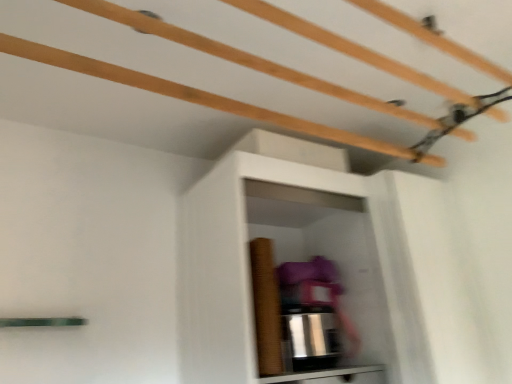
Where is `matte brown cabinet at lower center`? This screenshot has width=512, height=384. matte brown cabinet at lower center is located at coordinates (332, 376).

This screenshot has height=384, width=512. What do you see at coordinates (332, 376) in the screenshot? I see `matte brown cabinet at lower center` at bounding box center [332, 376].

Describe the element at coordinates (233, 62) in the screenshot. The image size is (512, 384). I see `white matte shelf at center` at that location.

At what (x,y) coordinates should I click in order to perform the action: click on white matte shelf at center. Please return your answer as a coordinate pair (x, y). The image size is (512, 384). Looking at the image, I should click on (233, 62).

I want to click on matte brown cabinet at lower center, so click(x=332, y=376).

Can you confirm if matte brown cabinet at lower center is positioned to the left of white matte shelf at center?

Incorrect, matte brown cabinet at lower center is not on the left side of white matte shelf at center.

Is matte brown cabinet at lower center behind white matte shelf at center?

That is True.

Does point (356, 375) appear closer or farther from the camera than point (364, 79)?

Point (356, 375).

From the image's perspective, is matte brown cabinet at lower center on top of white matte shelf at center?

Actually, matte brown cabinet at lower center appears below white matte shelf at center in the image.

From a real-world perspective, is matte brown cabinet at lower center physically below white matte shelf at center?

Yes, from a real-world perspective, matte brown cabinet at lower center is below white matte shelf at center.

Looking at their sizes, would you say matte brown cabinet at lower center is wider or thinner than white matte shelf at center?

matte brown cabinet at lower center is thinner than white matte shelf at center.

From the picture: Considering the relative sizes of matte brown cabinet at lower center and white matte shelf at center in the image provided, is matte brown cabinet at lower center shorter than white matte shelf at center?

No.

Can you confirm if matte brown cabinet at lower center is smaller than white matte shelf at center?

Yes, matte brown cabinet at lower center is smaller than white matte shelf at center.

Is matte brown cabinet at lower center spatially inside white matte shelf at center, or outside of it?

matte brown cabinet at lower center is outside white matte shelf at center.

Does matte brown cabinet at lower center touch white matte shelf at center?

matte brown cabinet at lower center and white matte shelf at center are clearly separated.

Is white matte shelf at center at the back of matte brown cabinet at lower center?

No, matte brown cabinet at lower center's orientation is not away from white matte shelf at center.

How much distance is there between matte brown cabinet at lower center and white matte shelf at center?

The distance of matte brown cabinet at lower center from white matte shelf at center is 38.77 inches.

Find the location of a particular element. The width and height of the screenshot is (512, 384). shelf above the matte brown cabinet at lower center (from the image's perspective) is located at coordinates (233, 62).

Which is more to the left, white matte shelf at center or matte brown cabinet at lower center?

white matte shelf at center.

Considering the positions of objects white matte shelf at center and matte brown cabinet at lower center in the image provided, who is in front, white matte shelf at center or matte brown cabinet at lower center?

white matte shelf at center is more forward.

Is point (193, 79) closer or farther from the camera than point (350, 367)?

Point (193, 79) is closer to the camera than point (350, 367).

From the image's perspective, who appears lower, white matte shelf at center or matte brown cabinet at lower center?

matte brown cabinet at lower center, from the image's perspective.

From a real-world perspective, is white matte shelf at center physically below matte brown cabinet at lower center?

Actually, white matte shelf at center is physically above matte brown cabinet at lower center in the real world.

Between white matte shelf at center and matte brown cabinet at lower center, which one has larger width?

white matte shelf at center.

From their relative heights in the image, would you say white matte shelf at center is taller or shorter than matte brown cabinet at lower center?

white matte shelf at center is shorter than matte brown cabinet at lower center.

Is white matte shelf at center bigger or smaller than matte brown cabinet at lower center?

white matte shelf at center is bigger than matte brown cabinet at lower center.

Is matte brown cabinet at lower center located within white matte shelf at center?

No, matte brown cabinet at lower center is not inside white matte shelf at center.

In the scene shown: Is white matte shelf at center positioned far away from matte brown cabinet at lower center?

No, white matte shelf at center is in close proximity to matte brown cabinet at lower center.

Could you tell me if white matte shelf at center is turned towards matte brown cabinet at lower center?

No.

Can you tell me how much white matte shelf at center and matte brown cabinet at lower center differ in facing direction?

They differ by 1.09 degrees in their facing directions.

You are a GUI agent. You are given a task and a screenshot of the screen. Output one action in this format:
    pyautogui.click(x=<x>, y=<y>)
    Task: Click on the cabinetry on the right of white matte shelf at center
    
    Given the screenshot: What is the action you would take?
    pyautogui.click(x=332, y=376)

The image size is (512, 384). I want to click on shelf above the matte brown cabinet at lower center (from the image's perspective), so click(x=233, y=62).

This screenshot has height=384, width=512. I want to click on cabinetry that is on the right side of white matte shelf at center, so click(x=332, y=376).